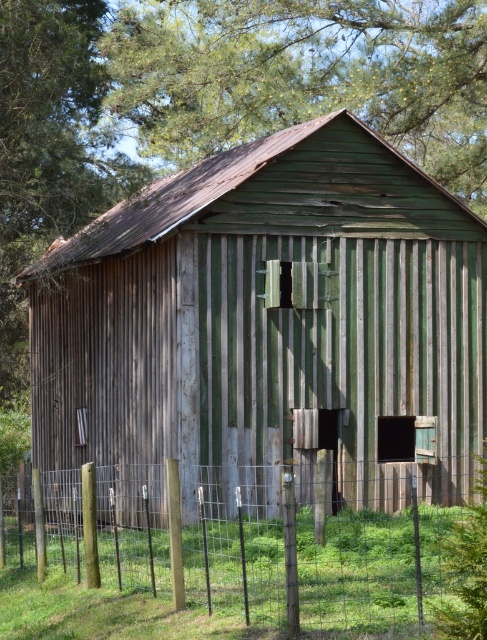
Question: Which point is farther from the camera taking this photo?

Choices:
 (A) (306, 568)
 (B) (237, 256)

Answer: (B)

Question: Is green corrugated metal barn at center below metal wire fence at lower center?

Choices:
 (A) no
 (B) yes

Answer: (A)

Question: Can you confirm if green corrugated metal barn at center is bigger than metal wire fence at lower center?

Choices:
 (A) yes
 (B) no

Answer: (A)

Question: Which of the following is the closest to the observer?

Choices:
 (A) (459, 332)
 (B) (377, 472)

Answer: (B)

Question: Among these points, which one is farthest from the camera?

Choices:
 (A) (381, 611)
 (B) (236, 273)

Answer: (B)

Question: Can you confirm if green corrugated metal barn at center is bigger than metal wire fence at lower center?

Choices:
 (A) yes
 (B) no

Answer: (A)